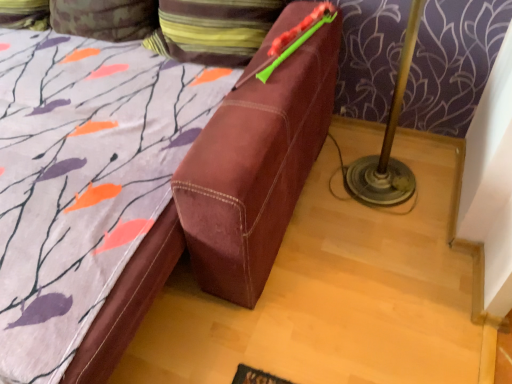
Question: From the image's perspective, is velvety brown pillow at upper center, the 2th pillow from the left, located above or below camouflage fabric pillow at upper left, marked as the 2th pillow in a right-to-left arrangement?

Choices:
 (A) below
 (B) above

Answer: (A)

Question: Does point (236, 52) appear closer or farther from the camera than point (108, 0)?

Choices:
 (A) farther
 (B) closer

Answer: (B)

Question: Is velvety brown pillow at upper center, the 2th pillow from the left, taller or shorter than camouflage fabric pillow at upper left, marked as the 2th pillow in a right-to-left arrangement?

Choices:
 (A) short
 (B) tall

Answer: (B)

Question: Considering the positions of camouflage fabric pillow at upper left, placed as the first pillow when sorted from left to right, and velvety brown pillow at upper center, arranged as the 1th pillow when viewed from the right, in the image, is camouflage fabric pillow at upper left, placed as the first pillow when sorted from left to right, taller or shorter than velvety brown pillow at upper center, arranged as the 1th pillow when viewed from the right,?

Choices:
 (A) tall
 (B) short

Answer: (B)

Question: Considering the positions of camouflage fabric pillow at upper left, marked as the 2th pillow in a right-to-left arrangement, and velvety brown pillow at upper center, arranged as the 1th pillow when viewed from the right, in the image, is camouflage fabric pillow at upper left, marked as the 2th pillow in a right-to-left arrangement, bigger or smaller than velvety brown pillow at upper center, arranged as the 1th pillow when viewed from the right,?

Choices:
 (A) small
 (B) big

Answer: (A)

Question: Do you think camouflage fabric pillow at upper left, placed as the first pillow when sorted from left to right, is within velvety brown pillow at upper center, the 2th pillow from the left, or outside of it?

Choices:
 (A) outside
 (B) inside

Answer: (A)

Question: Looking at their shapes, would you say camouflage fabric pillow at upper left, placed as the first pillow when sorted from left to right, is wider or thinner than velvety brown pillow at upper center, arranged as the 1th pillow when viewed from the right?

Choices:
 (A) thin
 (B) wide

Answer: (A)